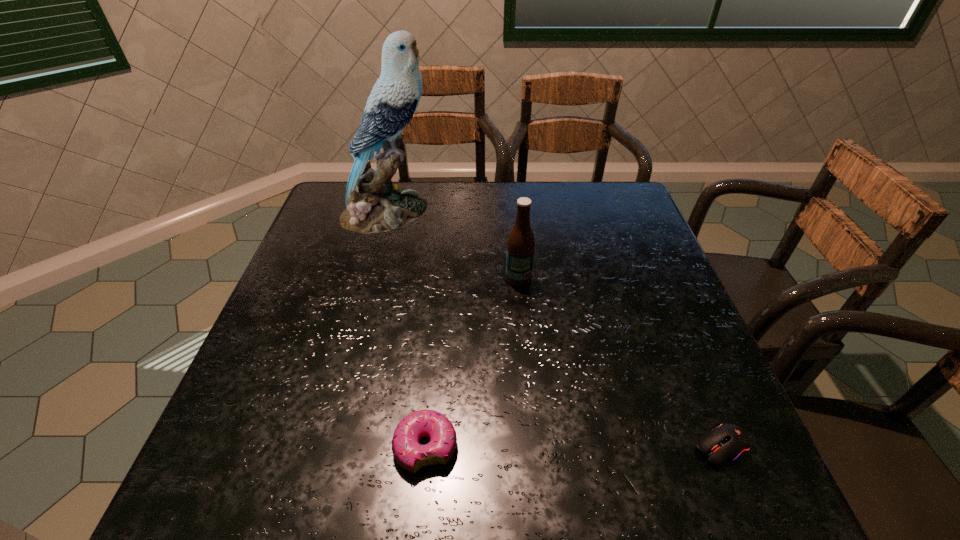
In order to click on free space at the left edge of the desktop in this screenshot , I will do `click(258, 395)`.

Image resolution: width=960 pixels, height=540 pixels. I want to click on vacant space at the right edge, so click(660, 443).

Find the location of a particular element. The width and height of the screenshot is (960, 540). free spot at the far left corner of the desktop is located at coordinates (341, 208).

In the image, there is a desktop. Identify the location of vacant space at the far right corner. (621, 206).

The height and width of the screenshot is (540, 960). In the image, there is a desktop. In order to click on vacant space at the near right corner in this screenshot , I will do `click(712, 501)`.

Image resolution: width=960 pixels, height=540 pixels. Find the location of `vacant space that is in between the tallest object and the doughnut`. vacant space that is in between the tallest object and the doughnut is located at coordinates (407, 329).

Locate an element on the screen. The image size is (960, 540). blank region between the tallest object and the beer bottle is located at coordinates (453, 245).

You are a GUI agent. You are given a task and a screenshot of the screen. Output one action in this format:
    pyautogui.click(x=<x>, y=<y>)
    Task: Click on the vacant space that's between the parakeet and the shortest object
    
    Given the screenshot: What is the action you would take?
    pyautogui.click(x=555, y=330)

Locate an element on the screen. vacant space that is in between the parakeet and the doughnut is located at coordinates (407, 329).

I want to click on free space between the computer mouse and the second object from right to left, so click(620, 363).